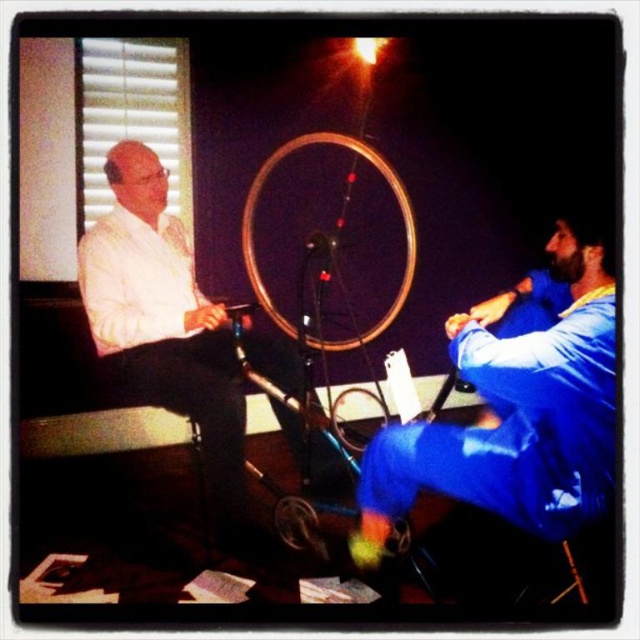
At what (x,y) coordinates should I click in order to perform the action: click on blue fabric pants at right. Please return your answer as a coordinate pair (x, y). The height and width of the screenshot is (640, 640). Looking at the image, I should click on (515, 410).

Which is more to the right, blue fabric pants at right or wooden bicycle wheel at center?

blue fabric pants at right

Identify the location of blue fabric pants at right. The image size is (640, 640). (515, 410).

This screenshot has height=640, width=640. Find the location of `blue fabric pants at right`. blue fabric pants at right is located at coordinates (515, 410).

Is white matte shirt at left to the left of metallic gold bicycle wheel at center from the viewer's perspective?

Indeed, white matte shirt at left is positioned on the left side of metallic gold bicycle wheel at center.

Who is more distant from viewer, (x=173, y=365) or (x=369, y=396)?

Positioned behind is point (x=369, y=396).

Where is `white matte shirt at left`? Image resolution: width=640 pixels, height=640 pixels. white matte shirt at left is located at coordinates (163, 317).

Is wooden bicycle wheel at center to the right of metallic gold bicycle wheel at center from the viewer's perspective?

Incorrect, wooden bicycle wheel at center is not on the right side of metallic gold bicycle wheel at center.

Is the position of wooden bicycle wheel at center more distant than that of metallic gold bicycle wheel at center?

Yes.

Describe the element at coordinates (403, 220) in the screenshot. I see `wooden bicycle wheel at center` at that location.

Image resolution: width=640 pixels, height=640 pixels. In order to click on wooden bicycle wheel at center in this screenshot , I will do (x=403, y=220).